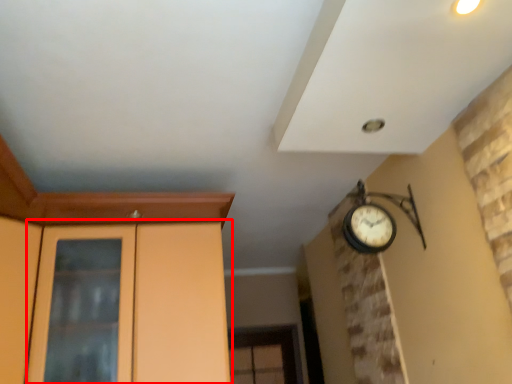
Question: From the image, what is the correct spatial relationship of dresser (annotated by the red box) in relation to door?

Choices:
 (A) left
 (B) right

Answer: (B)